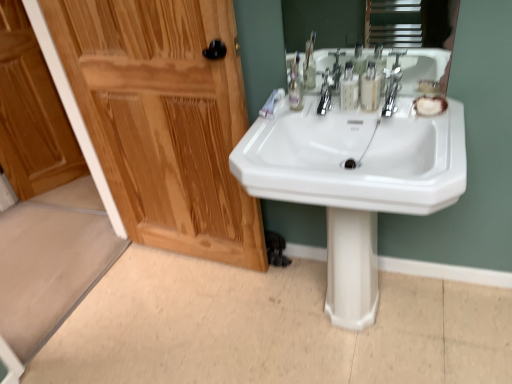
At what (x,y) coordinates should I click in order to perform the action: click on vacant region below shiny wood door at left (from a real-world perspective). Please return your answer as a coordinate pair (x, y). The height and width of the screenshot is (384, 512). Looking at the image, I should click on (197, 261).